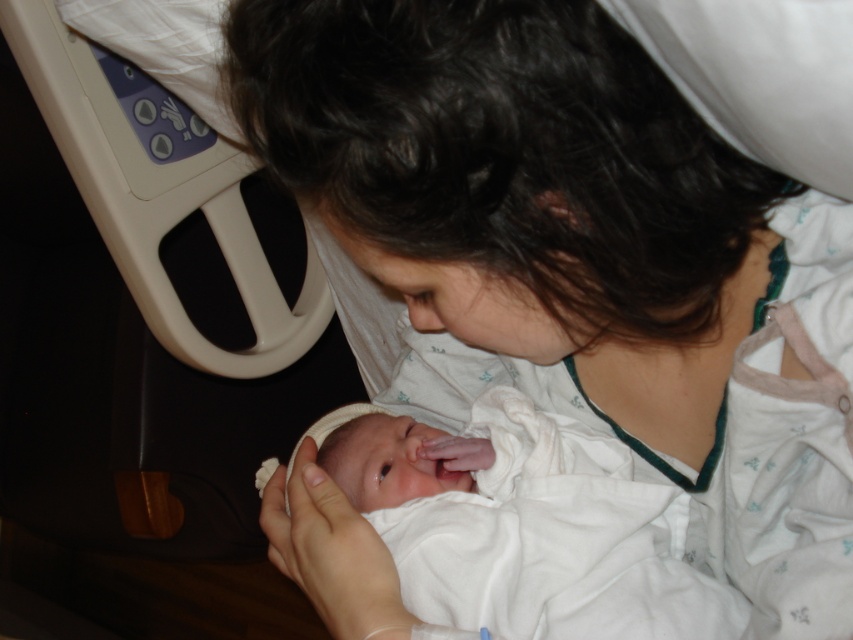
You are a nurse in a hospital room. You need to determine which item is taller between the white fabric at center and the white soft cloth at center. Based on the scene, which one is taller?

The white fabric at center is much taller than the white soft cloth at center.

What is located at the coordinates point [582,259] in the image?

The point [582,259] corresponds to the white fabric at center.